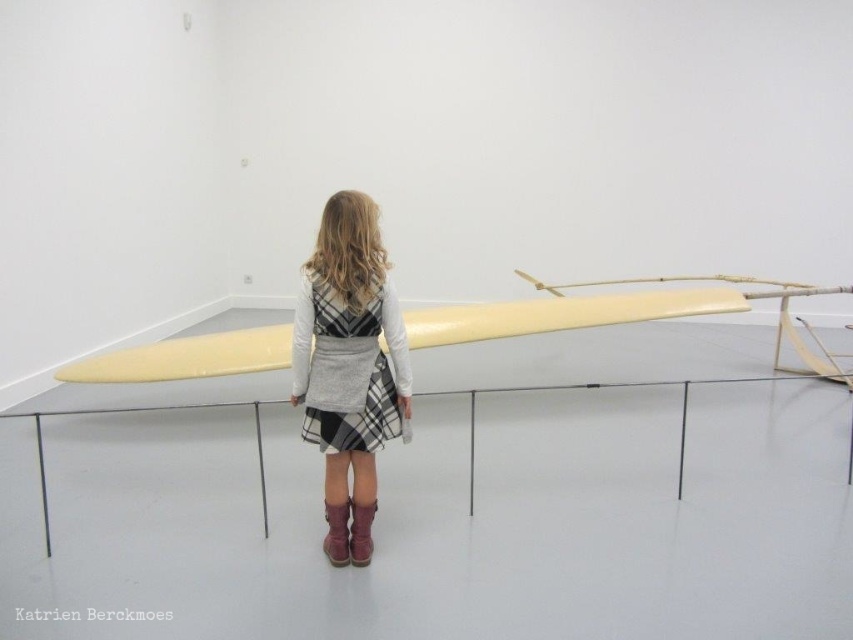
The girl is wearing a plaid fabric dress at center and brown suede boot at center. If she takes a step forward, which item will appear larger to her?

The plaid fabric dress at center will appear larger because it is closer to the viewer than the brown suede boot at center.